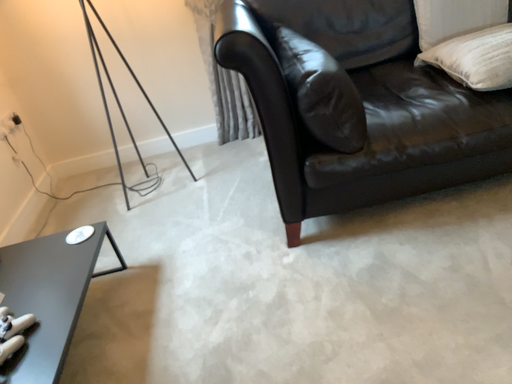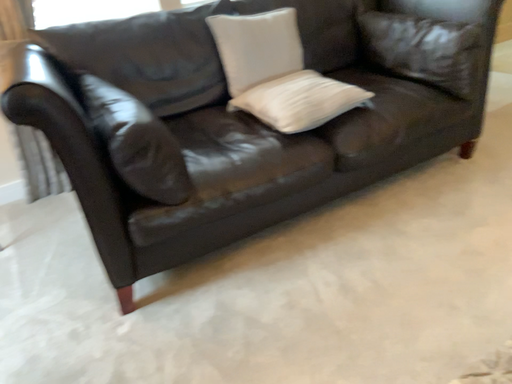
Question: How did the camera likely rotate when shooting the video?

Choices:
 (A) rotated upward
 (B) rotated downward

Answer: (A)